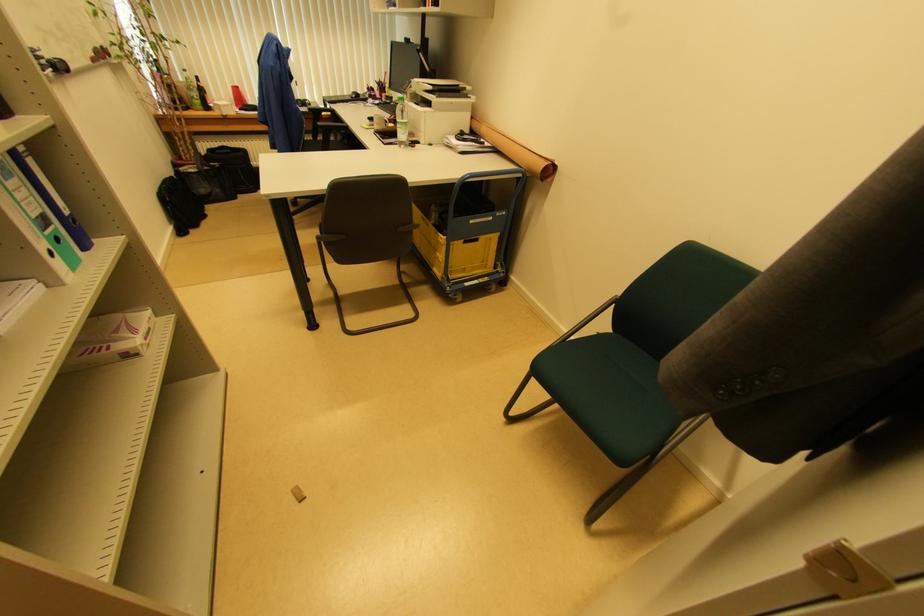
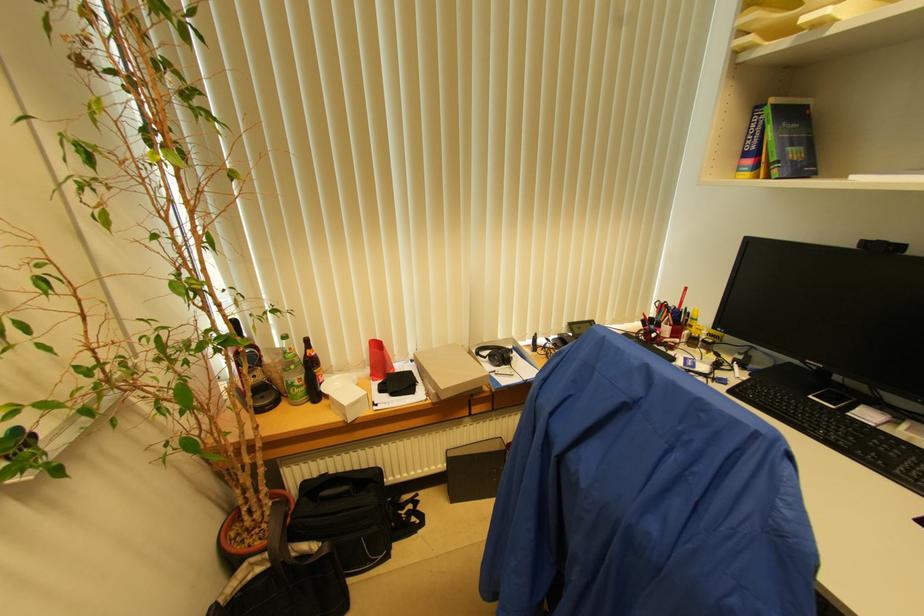
The point at (200, 169) is marked in the first image. Where is the corresponding point in the second image?

(273, 561)